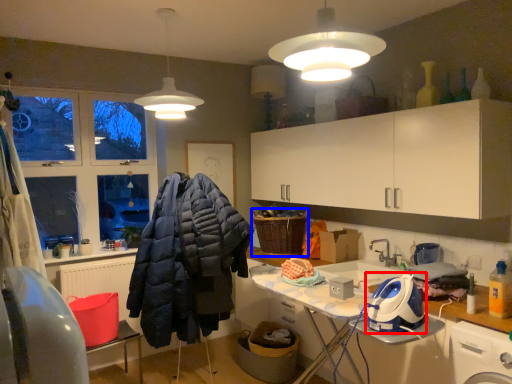
Question: Which point is further to the camera, appliance (highlighted by a red box) or basket (highlighted by a blue box)?

Choices:
 (A) appliance
 (B) basket

Answer: (B)